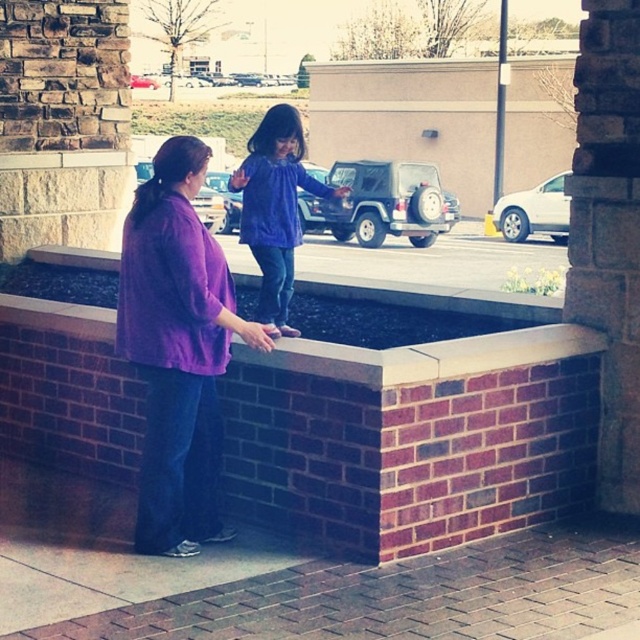
Question: Which point is farther to the camera?

Choices:
 (A) (294, 163)
 (B) (196, 440)
 (C) (490, 298)

Answer: (C)

Question: Does purple matte shirt at left appear on the right side of brick ledge at center?

Choices:
 (A) no
 (B) yes

Answer: (A)

Question: Which object is closer to the camera taking this photo?

Choices:
 (A) brick pillar at center
 (B) purple matte dress at center
 (C) brick ledge at center
 (D) purple matte shirt at left

Answer: (D)

Question: Does purple matte shirt at left appear on the right side of purple matte dress at center?

Choices:
 (A) no
 (B) yes

Answer: (A)

Question: Which of the following is the closest to the observer?

Choices:
 (A) (147, 532)
 (B) (81, 330)

Answer: (A)

Question: Where is brick ledge at center located in relation to purple matte dress at center in the image?

Choices:
 (A) left
 (B) right

Answer: (B)